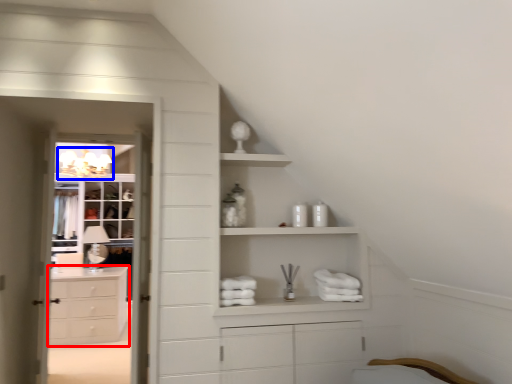
Question: Among these objects, which one is farthest to the camera, chest of drawers (highlighted by a red box) or light fixture (highlighted by a blue box)?

Choices:
 (A) chest of drawers
 (B) light fixture

Answer: (B)